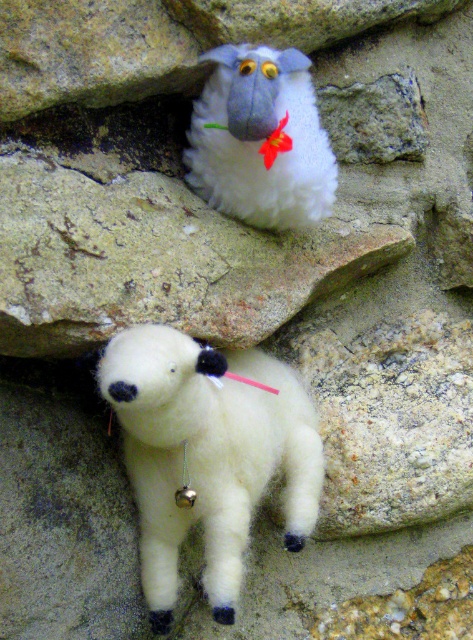
You are a child trying to fit both the white fluffy lamb at lower center and the white fluffy sheep at upper center into a rectangular box. The box can only accommodate items up to the size of the larger toy. Which toy should you place first to ensure both fit?

The white fluffy lamb at lower center is larger than the white fluffy sheep at upper center, so you should place the white fluffy lamb at lower center first to ensure both fit in the box.

You are standing in front of the two sheep toys. You need to reach a point that is exactly 40 inches away from you. Can you reach the point at point (268, 408) with your hand?

The distance between point (268, 408) and the camera is 39.30 inches, which is less than 40 inches. Therefore, you can reach the point at point (268, 408) with your hand.

You are standing in front of a stone wall with two fluffy toys. You see a point at coordinates (208, 456). Which toy is located at that point?

The white fluffy lamb at lower center is located at point (208, 456).